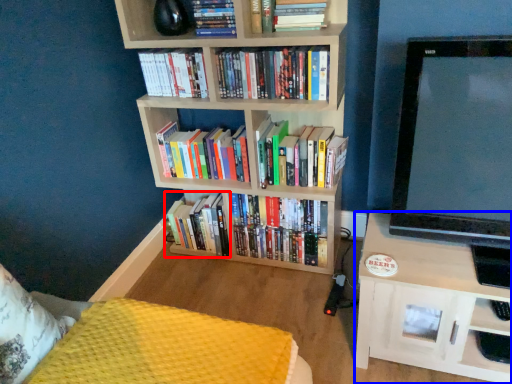
Question: Which object appears closest to the camera in this image, book (highlighted by a red box) or shelf (highlighted by a blue box)?

Choices:
 (A) book
 (B) shelf

Answer: (B)